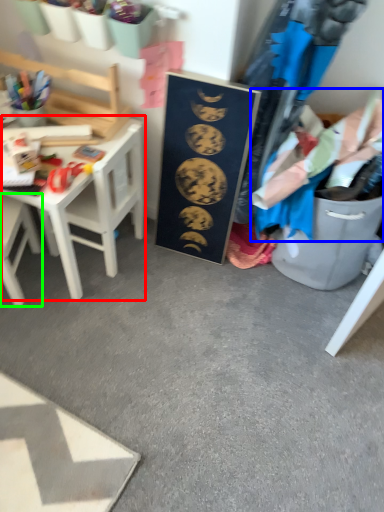
Question: Which object is the farthest from table (highlighted by a red box)? Choose among these: clothing (highlighted by a blue box) or chair (highlighted by a green box).

Choices:
 (A) clothing
 (B) chair

Answer: (A)